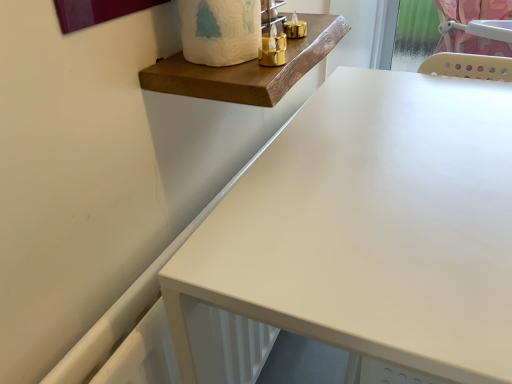
Question: Does white matte toilet paper at upper center come in front of matte white table at center?

Choices:
 (A) no
 (B) yes

Answer: (A)

Question: Is white matte toilet paper at upper center wider than matte white table at center?

Choices:
 (A) yes
 (B) no

Answer: (B)

Question: Considering the relative sizes of white matte toilet paper at upper center and matte white table at center in the image provided, is white matte toilet paper at upper center thinner than matte white table at center?

Choices:
 (A) no
 (B) yes

Answer: (B)

Question: From a real-world perspective, is white matte toilet paper at upper center physically below matte white table at center?

Choices:
 (A) no
 (B) yes

Answer: (A)

Question: Is white matte toilet paper at upper center oriented away from matte white table at center?

Choices:
 (A) yes
 (B) no

Answer: (B)

Question: Is the position of white matte toilet paper at upper center more distant than that of matte white table at center?

Choices:
 (A) no
 (B) yes

Answer: (B)

Question: Is wooden plank at upper center directly adjacent to matte white table at center?

Choices:
 (A) yes
 (B) no

Answer: (B)

Question: Is wooden plank at upper center facing towards matte white table at center?

Choices:
 (A) yes
 (B) no

Answer: (B)

Question: Is wooden plank at upper center shorter than matte white table at center?

Choices:
 (A) yes
 (B) no

Answer: (A)

Question: Is wooden plank at upper center further to camera compared to matte white table at center?

Choices:
 (A) yes
 (B) no

Answer: (A)

Question: Can you confirm if wooden plank at upper center is positioned to the right of matte white table at center?

Choices:
 (A) no
 (B) yes

Answer: (A)

Question: Is wooden plank at upper center facing away from matte white table at center?

Choices:
 (A) yes
 (B) no

Answer: (B)

Question: Considering the relative sizes of matte white table at center and white matte toilet paper at upper center in the image provided, is matte white table at center taller than white matte toilet paper at upper center?

Choices:
 (A) yes
 (B) no

Answer: (A)